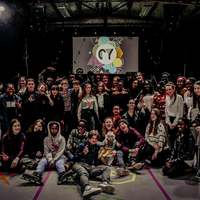
The height and width of the screenshot is (200, 200). I want to click on purple lines on floor, so pyautogui.click(x=158, y=186), pyautogui.click(x=41, y=188).